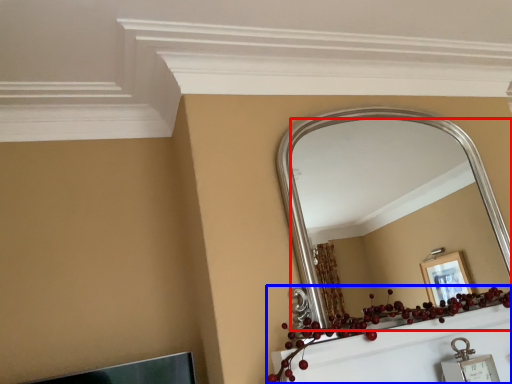
Question: Among these objects, which one is farthest to the camera, mirror (highlighted by a red box) or christmas decoration (highlighted by a blue box)?

Choices:
 (A) mirror
 (B) christmas decoration

Answer: (A)